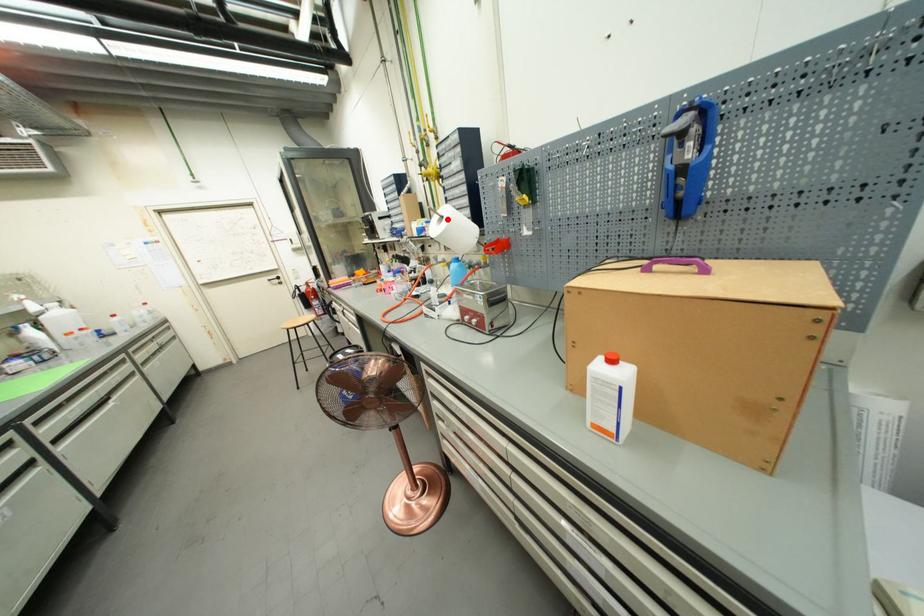
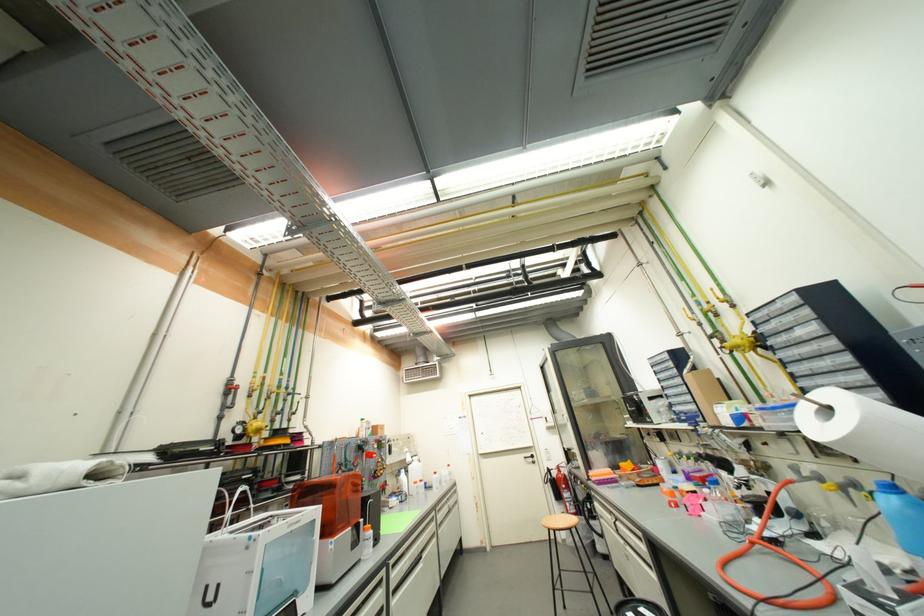
Where in the second image is the point corresponding to the highlighted location from the first image?

(833, 410)